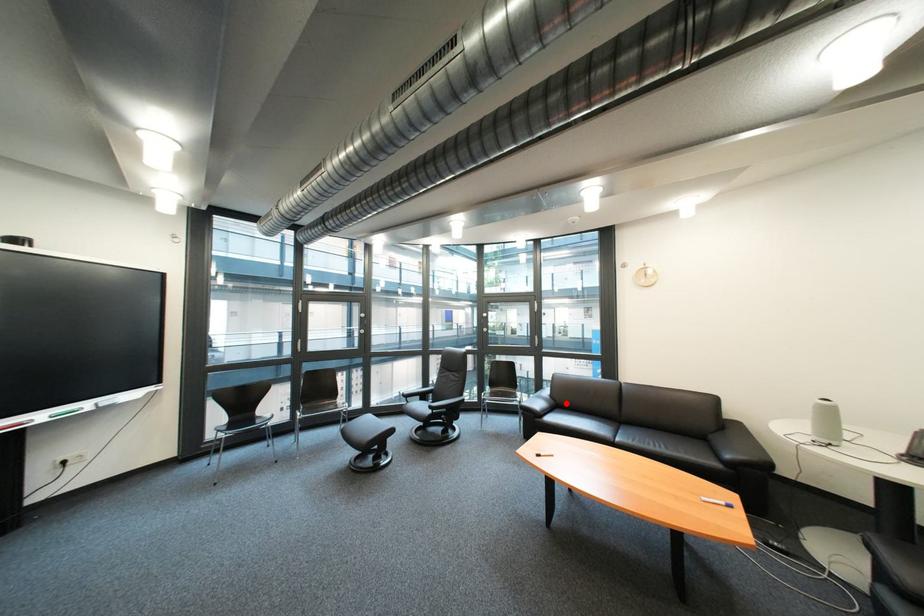
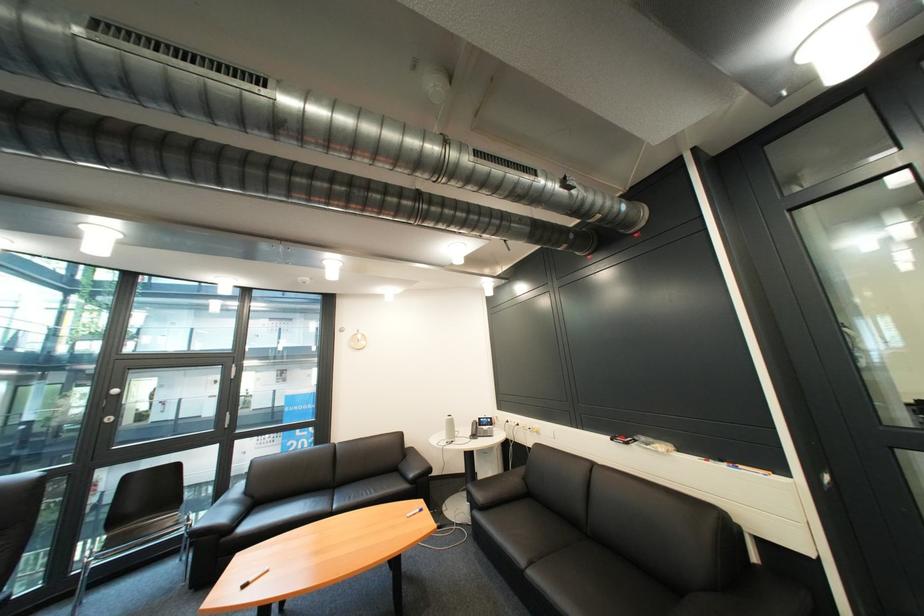
Where in the second image is the point corresponding to the highlighted location from the first image?

(262, 503)